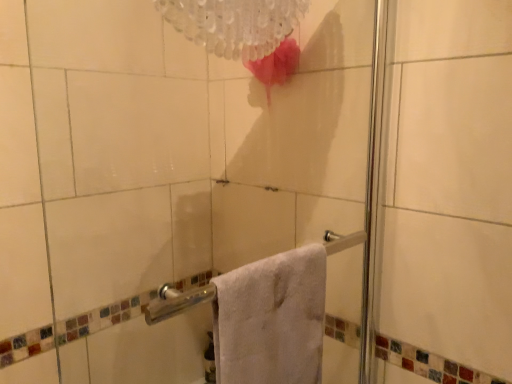
Measure the distance between point (281, 314) and camera.

Point (281, 314) and camera are 72.50 centimeters apart from each other.

This screenshot has height=384, width=512. What do you see at coordinates (271, 319) in the screenshot?
I see `white soft towel at center` at bounding box center [271, 319].

You are a GUI agent. You are given a task and a screenshot of the screen. Output one action in this format:
    pyautogui.click(x=<x>, y=<y>)
    Task: Click on the white soft towel at center
    
    Given the screenshot: What is the action you would take?
    pyautogui.click(x=271, y=319)

In order to click on white soft towel at center in this screenshot , I will do `click(271, 319)`.